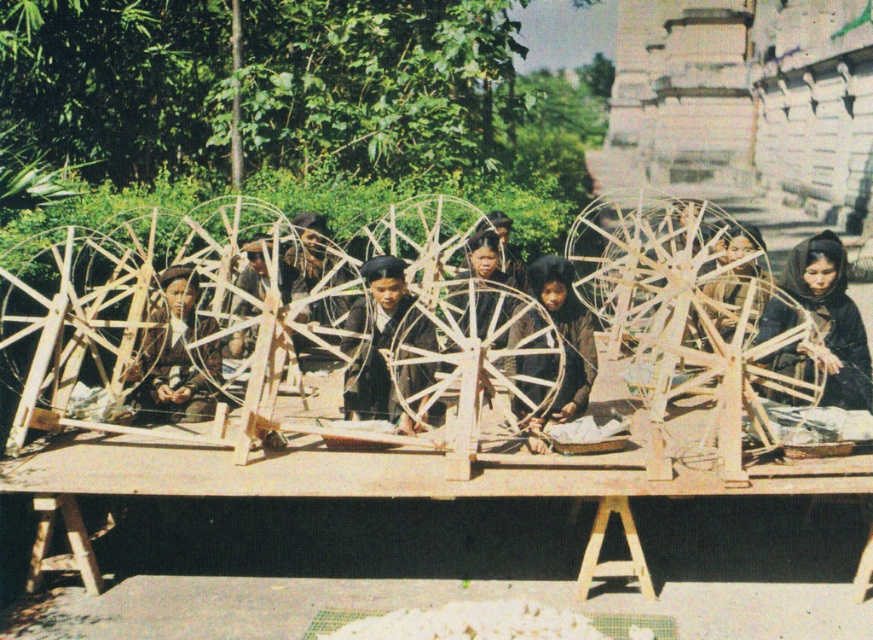
Looking at this image, is dark brown fabric at center behind brown fabric at center?

No, dark brown fabric at center is closer to the viewer.

Looking at this image, can you confirm if dark brown fabric at center is wider than brown fabric at center?

Correct, the width of dark brown fabric at center exceeds that of brown fabric at center.

Is point (775, 365) positioned after point (579, 333)?

No.

Locate an element on the screen. The width and height of the screenshot is (873, 640). dark brown fabric at center is located at coordinates point(826,324).

Does dark brown wooden spinning wheel at center lie in front of brown wooden spinning wheel at center?

Yes, dark brown wooden spinning wheel at center is in front of brown wooden spinning wheel at center.

Does dark brown wooden spinning wheel at center come behind brown wooden spinning wheel at center?

No, dark brown wooden spinning wheel at center is in front of brown wooden spinning wheel at center.

Which is in front, point (407, 384) or point (194, 310)?

Point (407, 384) is more forward.

Where is `dark brown wooden spinning wheel at center`? The height and width of the screenshot is (640, 873). dark brown wooden spinning wheel at center is located at coordinates (382, 340).

Between dark brown fabric at center and dark brown wooden spinning wheel at center, which one is positioned lower?

dark brown wooden spinning wheel at center

Is dark brown fabric at center below dark brown wooden spinning wheel at center?

Incorrect, dark brown fabric at center is not positioned below dark brown wooden spinning wheel at center.

What do you see at coordinates (826, 324) in the screenshot?
I see `dark brown fabric at center` at bounding box center [826, 324].

Locate an element on the screen. The image size is (873, 640). dark brown fabric at center is located at coordinates (826, 324).